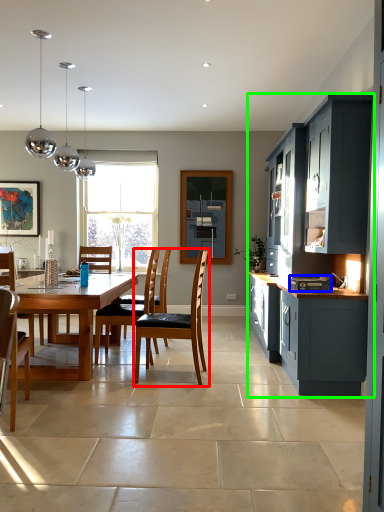
Question: Estimate the real-world distances between objects in this image. Which object is farther from chair (highlighted by a red box), appliance (highlighted by a blue box) or cabinetry (highlighted by a green box)?

Choices:
 (A) appliance
 (B) cabinetry

Answer: (B)